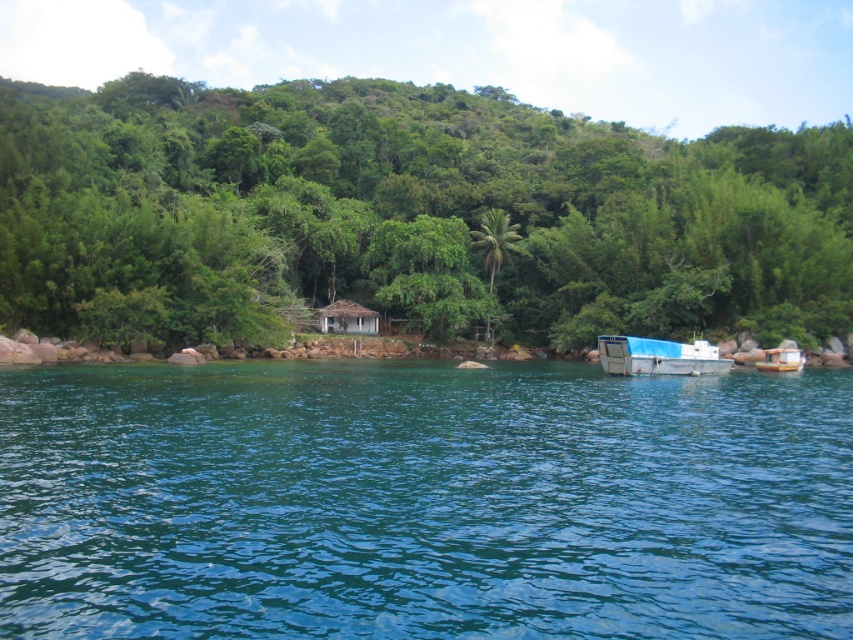
You are standing on the shore and want to determine if the clear blue water at center is deeper than the white matte boat at lower right. Based on the scene, can you tell which one is deeper?

The clear blue water at center has a lesser height compared to the white matte boat at lower right, so the white matte boat at lower right is deeper.

You are standing on the dock and want to reach the brown thatched hut at center. Which direction should you walk relative to the green leafy tree at center?

You should walk to the right of the green leafy tree at center to reach the brown thatched hut at center because the brown thatched hut at center is to the right of the green leafy tree at center.